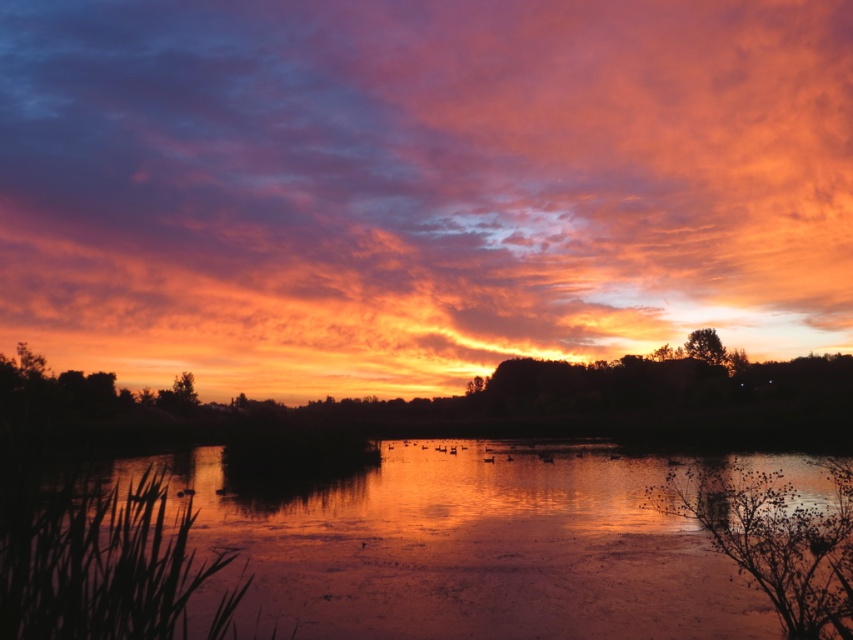
Question: Which of the following is the farthest from the observer?

Choices:
 (A) matte orange cloud at upper center
 (B) glossy water at center

Answer: (A)

Question: Can you confirm if matte orange cloud at upper center is positioned below glossy water at center?

Choices:
 (A) yes
 (B) no

Answer: (B)

Question: Is matte orange cloud at upper center to the left of glossy water at center from the viewer's perspective?

Choices:
 (A) no
 (B) yes

Answer: (A)

Question: Observing the image, what is the correct spatial positioning of matte orange cloud at upper center in reference to glossy water at center?

Choices:
 (A) below
 (B) above

Answer: (B)

Question: Which point appears farthest from the camera in this image?

Choices:
 (A) (665, 556)
 (B) (773, 285)

Answer: (B)